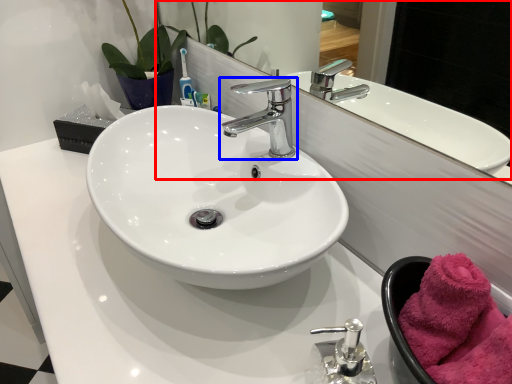
Question: Which of the following is the closest to the observer, mirror (highlighted by a red box) or tap (highlighted by a blue box)?

Choices:
 (A) mirror
 (B) tap

Answer: (A)